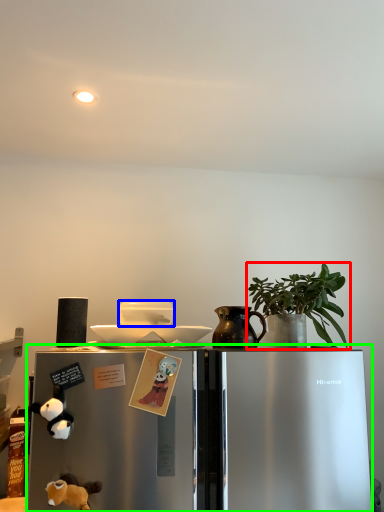
Question: Based on their relative distances, which object is farther from houseplant (highlighted by a red box)? Choose from appliance (highlighted by a blue box) and refrigerator (highlighted by a green box).

Choices:
 (A) appliance
 (B) refrigerator

Answer: (A)